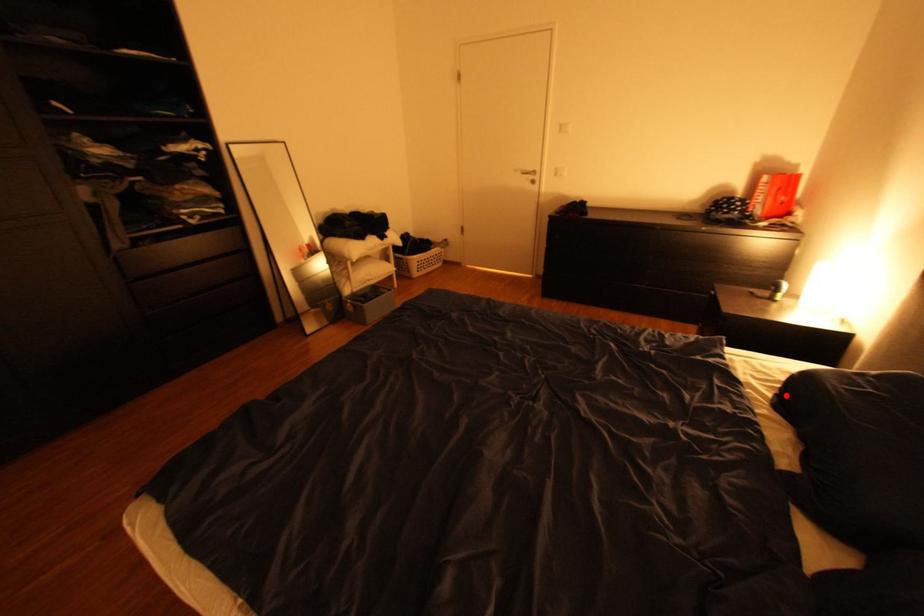
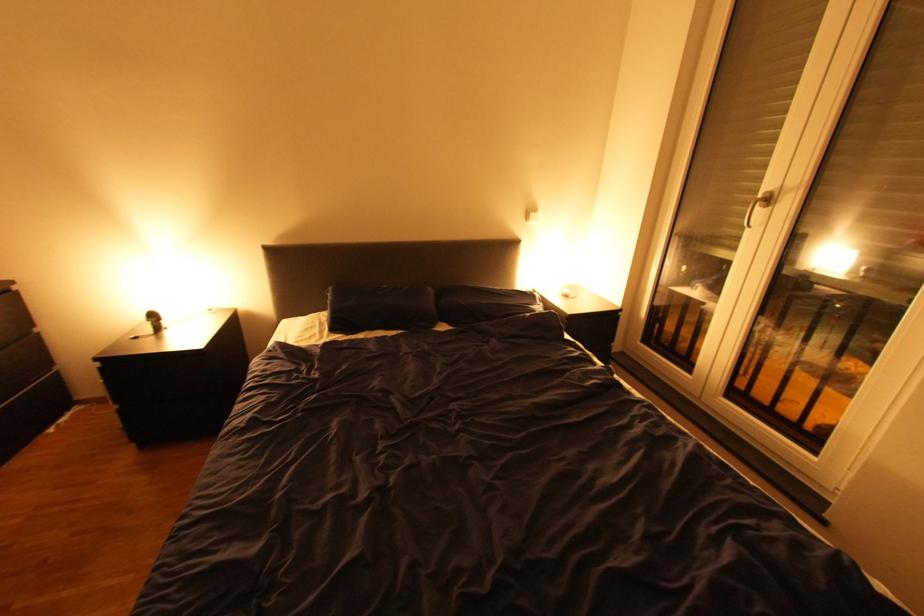
Question: I am providing you with two images of the same scene from different viewpoints. A red point is marked on the first image. Is the red point's position out of view in image 2?

Choices:
 (A) Yes
 (B) No

Answer: (B)